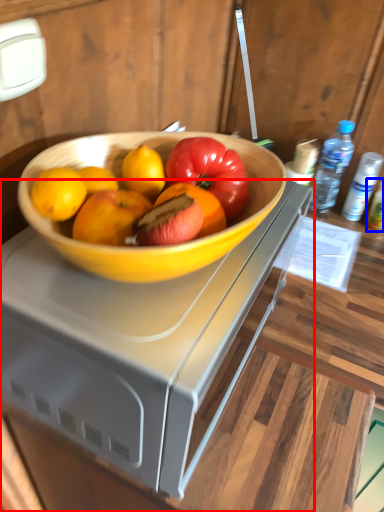
Question: Which of the following is the closest to the observer, desk (highlighted by a red box) or bottle (highlighted by a blue box)?

Choices:
 (A) desk
 (B) bottle

Answer: (A)